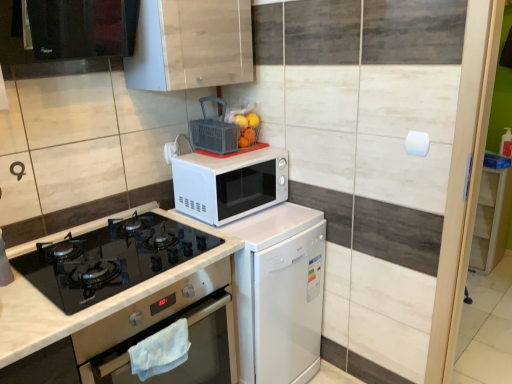
What is the approximate width of black glass oven at lower left?

black glass oven at lower left is 5.60 inches wide.

You are a GUI agent. You are given a task and a screenshot of the screen. Output one action in this format:
    pyautogui.click(x=<x>, y=<y>)
    Task: Click on the black glass oven at lower left
    This screenshot has width=512, height=384.
    Given the screenshot: What is the action you would take?
    pyautogui.click(x=162, y=328)

Describe the element at coordinates (279, 293) in the screenshot. This screenshot has width=512, height=384. I see `white glossy dishwasher at center` at that location.

Describe the element at coordinates (191, 45) in the screenshot. I see `wooden cabinet at upper center, which is the 1th cabinetry from left to right` at that location.

Where is `black glass oven at lower left`? black glass oven at lower left is located at coordinates (162, 328).

Between white matte microwave at center, which appears as the second appliance when viewed from the right, and white glossy dishwasher at center, which one has larger size?

With larger size is white glossy dishwasher at center.

Is white matte microwave at center, which appears as the second appliance when viewed from the right, positioned beyond the bounds of white glossy dishwasher at center?

Yes, white matte microwave at center, which appears as the second appliance when viewed from the right, is not within white glossy dishwasher at center.

Which is more distant, (x=187, y=152) or (x=242, y=348)?

Positioned behind is point (x=187, y=152).

Does white matte cabinet at right, the first cabinetry when ordered from back to front, turn towards white marble countertop at lower left?

No.

Is white matte cabinet at right, arranged as the first cabinetry when viewed from the right, not near white marble countertop at lower left?

That's right, there is a large distance between white matte cabinet at right, arranged as the first cabinetry when viewed from the right, and white marble countertop at lower left.

Where is `countertop in front of the white matte cabinet at right, the second cabinetry viewed from the left`? Image resolution: width=512 pixels, height=384 pixels. countertop in front of the white matte cabinet at right, the second cabinetry viewed from the left is located at coordinates (90, 306).

Which object is thinner, white matte cabinet at right, arranged as the first cabinetry when viewed from the right, or white marble countertop at lower left?

white matte cabinet at right, arranged as the first cabinetry when viewed from the right.

Is white marble countertop at lower left surrounded by wooden cabinet at upper center, which is the 1th cabinetry from left to right?

No, white marble countertop at lower left is not surrounded by wooden cabinet at upper center, which is the 1th cabinetry from left to right.

Considering the relative positions of wooden cabinet at upper center, which ranks as the second cabinetry in back-to-front order, and white marble countertop at lower left in the image provided, is wooden cabinet at upper center, which ranks as the second cabinetry in back-to-front order, to the left of white marble countertop at lower left from the viewer's perspective?

No.

Considering the relative positions of wooden cabinet at upper center, acting as the first cabinetry starting from the top, and white marble countertop at lower left in the image provided, is wooden cabinet at upper center, acting as the first cabinetry starting from the top, in front of white marble countertop at lower left?

No, the depth of wooden cabinet at upper center, acting as the first cabinetry starting from the top, is greater than that of white marble countertop at lower left.

Is white marble countertop at lower left at the back of wooden cabinet at upper center, marked as the second cabinetry in a bottom-to-top arrangement?

That's not correct — wooden cabinet at upper center, marked as the second cabinetry in a bottom-to-top arrangement, is not looking away from white marble countertop at lower left.

Consider the image. Which object is further away from the camera, matte plastic basket at upper center, the first appliance in the right-to-left sequence, or white matte microwave at center, which ranks as the 1th appliance in left-to-right order?

white matte microwave at center, which ranks as the 1th appliance in left-to-right order, is more distant.

Is matte plastic basket at upper center, the first appliance in the right-to-left sequence, facing away from white matte microwave at center, which ranks as the 1th appliance in left-to-right order?

Yes, matte plastic basket at upper center, the first appliance in the right-to-left sequence, is positioned with its back facing white matte microwave at center, which ranks as the 1th appliance in left-to-right order.

From a real-world perspective, does matte plastic basket at upper center, the first appliance in the right-to-left sequence, stand above white matte microwave at center, which appears as the second appliance when viewed from the right?

Yes, from a real-world perspective, matte plastic basket at upper center, the first appliance in the right-to-left sequence, is on top of white matte microwave at center, which appears as the second appliance when viewed from the right.

How different are the orientations of matte plastic basket at upper center, which ranks as the second appliance in left-to-right order, and white matte microwave at center, which ranks as the 1th appliance in left-to-right order, in degrees?

The angular difference between matte plastic basket at upper center, which ranks as the second appliance in left-to-right order, and white matte microwave at center, which ranks as the 1th appliance in left-to-right order, is 3.81 degrees.

From the image's perspective, is black glass oven at lower left below white marble countertop at lower left?

Actually, black glass oven at lower left appears above white marble countertop at lower left in the image.

Is white marble countertop at lower left a part of black glass oven at lower left?

Actually, white marble countertop at lower left is outside black glass oven at lower left.

Between black glass oven at lower left and white marble countertop at lower left, which one has more height?

Standing taller between the two is white marble countertop at lower left.

Is white matte microwave at center touching white glossy dishwasher at center?

white matte microwave at center is not next to white glossy dishwasher at center, and they're not touching.

Between white matte microwave at center and white glossy dishwasher at center, which one appears on the right side from the viewer's perspective?

white glossy dishwasher at center.

From a real-world perspective, is white matte microwave at center on top of white glossy dishwasher at center?

Yes, from a real-world perspective, white matte microwave at center is over white glossy dishwasher at center

From the image's perspective, does white matte microwave at center appear lower than white glossy dishwasher at center?

No.

From a real-world perspective, relative to white glossy dishwasher at center, is black glass exhaust hood at upper left vertically above or below?

Clearly, from a real-world perspective, black glass exhaust hood at upper left is above white glossy dishwasher at center.

Based on their sizes in the image, would you say black glass exhaust hood at upper left is bigger or smaller than white glossy dishwasher at center?

In the image, black glass exhaust hood at upper left appears to be smaller than white glossy dishwasher at center.

From the image's perspective, which object appears higher, black glass exhaust hood at upper left or white glossy dishwasher at center?

black glass exhaust hood at upper left, from the image's perspective.

At what (x,y) coordinates should I click in order to perform the action: click on the 2nd appliance behind the white glossy dishwasher at center, counting from the anchor's position. Please return your answer as a coordinate pair (x, y). Looking at the image, I should click on (177, 147).

I want to click on the 1st cabinetry above the white marble countertop at lower left (from the image's perspective), so click(x=490, y=219).

When comparing their distances from white matte microwave at center, does white marble countertop at lower left or matte plastic basket at upper center, which ranks as the second appliance in left-to-right order, seem closer?

matte plastic basket at upper center, which ranks as the second appliance in left-to-right order.

Estimate the real-world distances between objects in this image. Which object is closer to white glossy dishwasher at center, white marble countertop at lower left or white matte microwave at center, which appears as the second appliance when viewed from the right?

white marble countertop at lower left is closer to white glossy dishwasher at center.

Estimate the real-world distances between objects in this image. Which object is further from black glass exhaust hood at upper left, white matte microwave at center, which ranks as the 1th appliance in left-to-right order, or white marble countertop at lower left?

white marble countertop at lower left is further to black glass exhaust hood at upper left.

Which object lies further to the anchor point wooden cabinet at upper center, which ranks as the second cabinetry in back-to-front order, black glass oven at lower left or white matte cabinet at right, marked as the second cabinetry in a top-to-bottom arrangement?

The object further to wooden cabinet at upper center, which ranks as the second cabinetry in back-to-front order, is white matte cabinet at right, marked as the second cabinetry in a top-to-bottom arrangement.

Considering their positions, is white matte microwave at center positioned closer to black glass oven at lower left than wooden cabinet at upper center, acting as the first cabinetry starting from the top?

white matte microwave at center is closer to black glass oven at lower left.

When comparing their distances from wooden cabinet at upper center, marked as the second cabinetry in a bottom-to-top arrangement, does black glass exhaust hood at upper left or white glossy dishwasher at center seem closer?

black glass exhaust hood at upper left lies closer to wooden cabinet at upper center, marked as the second cabinetry in a bottom-to-top arrangement, than the other object.

Based on their spatial positions, is white matte cabinet at right, the first cabinetry when ordered from back to front, or black glass exhaust hood at upper left closer to wooden cabinet at upper center, which is the second cabinetry from right to left?

Based on the image, black glass exhaust hood at upper left appears to be nearer to wooden cabinet at upper center, which is the second cabinetry from right to left.

Which object lies further to the anchor point wooden cabinet at upper center, which is the 1th cabinetry from left to right, black glass exhaust hood at upper left or white marble countertop at lower left?

Based on the image, white marble countertop at lower left appears to be further to wooden cabinet at upper center, which is the 1th cabinetry from left to right.

Find the location of a particular element. oven that lies between wooden cabinet at upper center, which ranks as the second cabinetry in back-to-front order, and white marble countertop at lower left from top to bottom is located at coordinates (162, 328).

Where is `cabinetry situated between black glass oven at lower left and white matte cabinet at right, arranged as the first cabinetry when viewed from the right, from left to right`? This screenshot has height=384, width=512. cabinetry situated between black glass oven at lower left and white matte cabinet at right, arranged as the first cabinetry when viewed from the right, from left to right is located at coordinates (191, 45).

The image size is (512, 384). I want to click on dish washer between white matte microwave at center and black glass oven at lower left in the up-down direction, so click(279, 293).

Where is `microwave oven between wooden cabinet at upper center, marked as the second cabinetry in a bottom-to-top arrangement, and white marble countertop at lower left, in the vertical direction`? microwave oven between wooden cabinet at upper center, marked as the second cabinetry in a bottom-to-top arrangement, and white marble countertop at lower left, in the vertical direction is located at coordinates (229, 184).